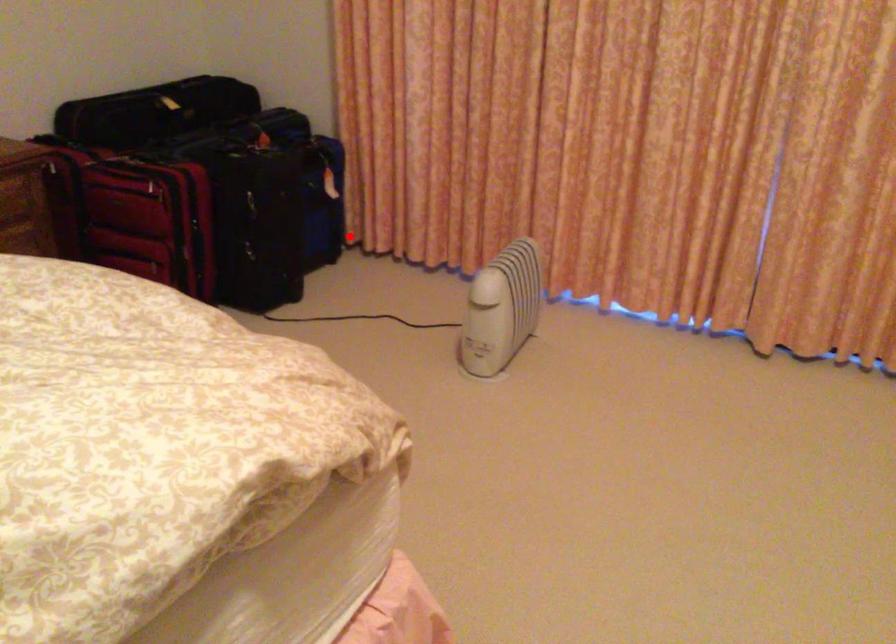
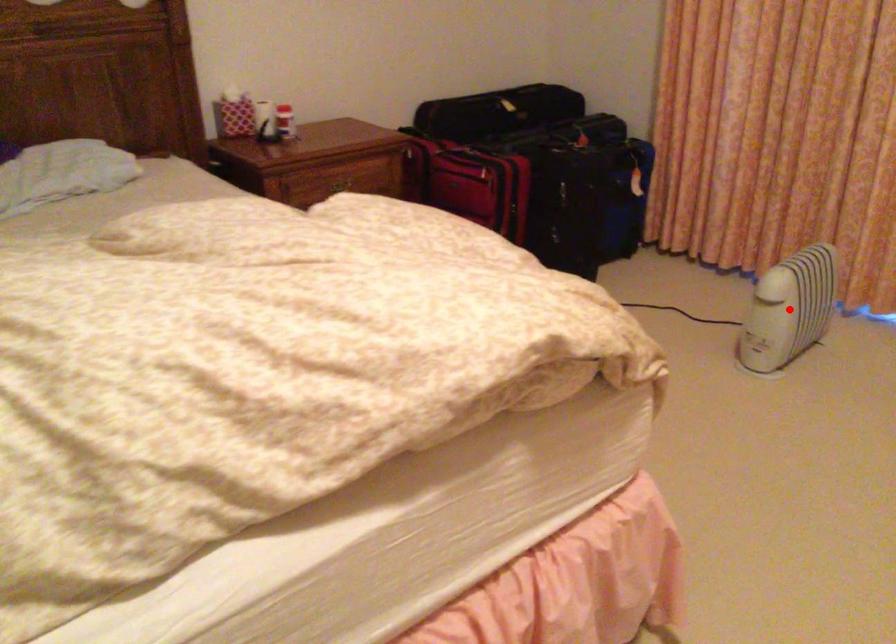
I am providing you with two images of the same scene from different viewpoints. A red point is marked on the first image and another point is marked on the second image. Does the point marked in image1 correspond to the same location as the one in image2?

No